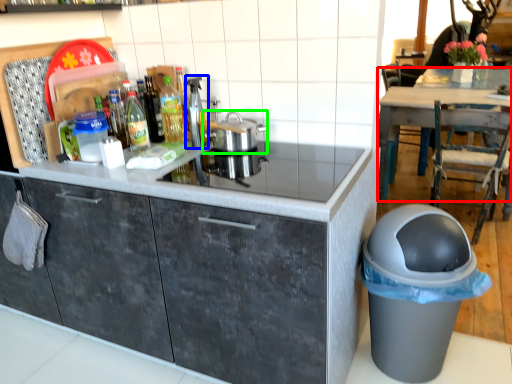
Question: Which object is the closest to the table (highlighted by a red box)? Choose among these: appliance (highlighted by a blue box) or kitchen appliance (highlighted by a green box).

Choices:
 (A) appliance
 (B) kitchen appliance

Answer: (B)